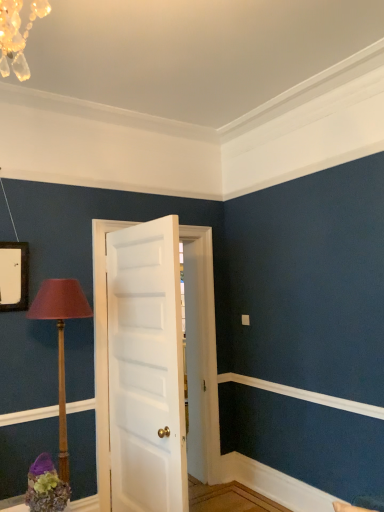
Question: From the image's perspective, is wooden table lamp at left above or below white matte door at center?

Choices:
 (A) below
 (B) above

Answer: (A)

Question: Is wooden table lamp at left inside or outside of white matte door at center?

Choices:
 (A) inside
 (B) outside

Answer: (B)

Question: Looking at their shapes, would you say wooden table lamp at left is wider or thinner than white matte door at center?

Choices:
 (A) wide
 (B) thin

Answer: (A)

Question: In the image, is white matte door at center positioned in front of or behind wooden table lamp at left?

Choices:
 (A) front
 (B) behind

Answer: (B)

Question: In terms of height, does white matte door at center look taller or shorter compared to wooden table lamp at left?

Choices:
 (A) tall
 (B) short

Answer: (A)

Question: Considering the relative positions of white matte door at center and wooden table lamp at left in the image provided, is white matte door at center to the left or to the right of wooden table lamp at left?

Choices:
 (A) left
 (B) right

Answer: (B)

Question: In terms of size, does white matte door at center appear bigger or smaller than wooden table lamp at left?

Choices:
 (A) small
 (B) big

Answer: (B)